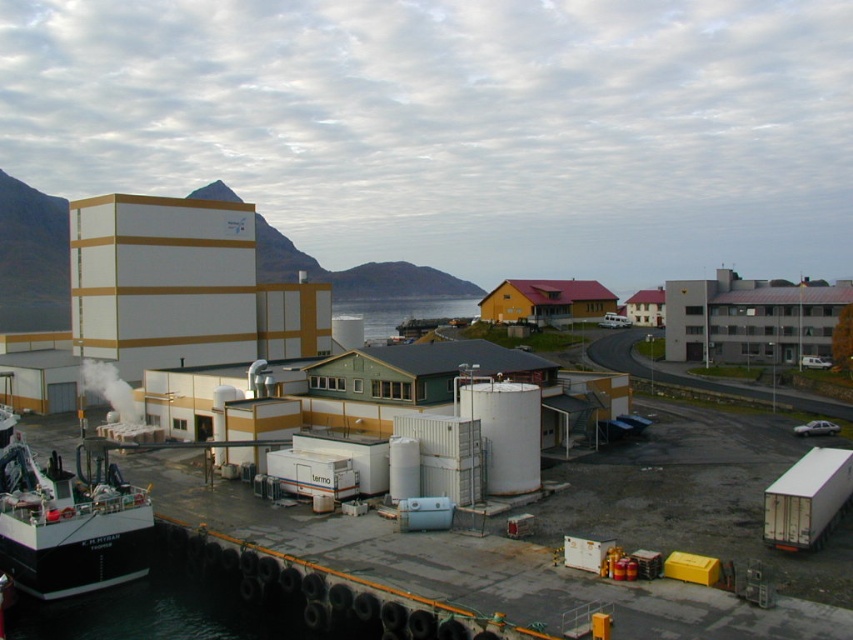
Question: Where is black matte boat at lower left located in relation to transparent water at center in the image?

Choices:
 (A) right
 (B) left

Answer: (B)

Question: Which point is farther to the camera?

Choices:
 (A) (476, 307)
 (B) (109, 531)

Answer: (A)

Question: Can you confirm if black matte boat at lower left is thinner than transparent water at center?

Choices:
 (A) yes
 (B) no

Answer: (A)

Question: Which point appears closest to the camera in this image?

Choices:
 (A) (90, 506)
 (B) (352, 316)

Answer: (A)

Question: Which point is closer to the camera?

Choices:
 (A) (100, 563)
 (B) (413, 301)

Answer: (A)

Question: Is black matte boat at lower left behind transparent water at center?

Choices:
 (A) yes
 (B) no

Answer: (B)